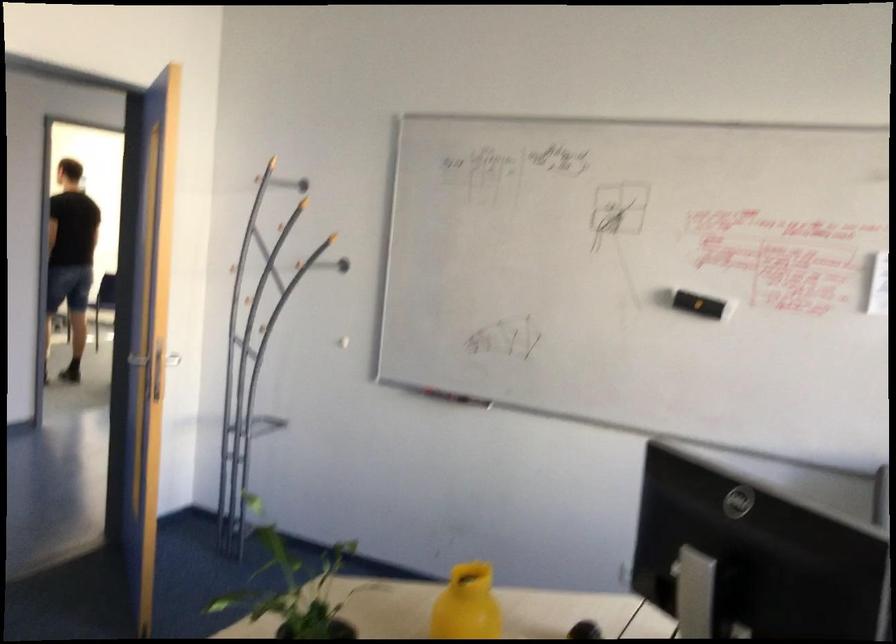
Where is `whiteboard eraser`? The image size is (896, 644). whiteboard eraser is located at coordinates (702, 305).